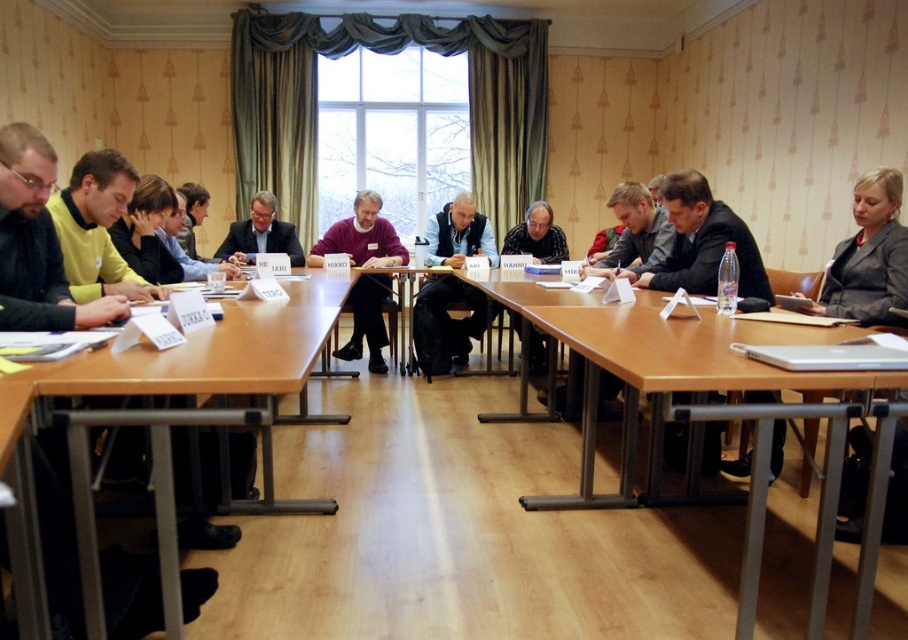
Question: Among these points, which one is nearest to the camera?

Choices:
 (A) (253, 212)
 (B) (492, 243)
 (C) (864, 260)
 (D) (357, 260)

Answer: (C)

Question: Can you confirm if brown wooden table at center is positioned to the left of dark gray suit at right?

Choices:
 (A) no
 (B) yes

Answer: (B)

Question: Can you confirm if brown wooden table at center is wider than matte gray suit at center?

Choices:
 (A) no
 (B) yes

Answer: (B)

Question: Which of these objects is positioned farthest from the black fleece vest at center?

Choices:
 (A) dark gray suit at right
 (B) dark gray suit at center
 (C) dark gray sweater at center

Answer: (A)

Question: Estimate the real-world distances between objects in this image. Which object is closer to the brown wooden table at center?

Choices:
 (A) dark gray suit at right
 (B) matte gray suit at center
 (C) brown wooden table at lower left
 (D) black fleece vest at center

Answer: (C)

Question: Does brown wooden table at center have a larger size compared to black fleece vest at center?

Choices:
 (A) yes
 (B) no

Answer: (A)